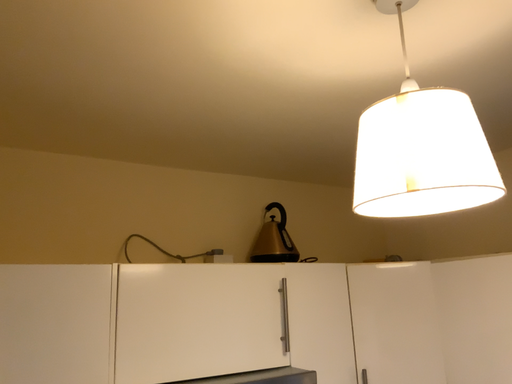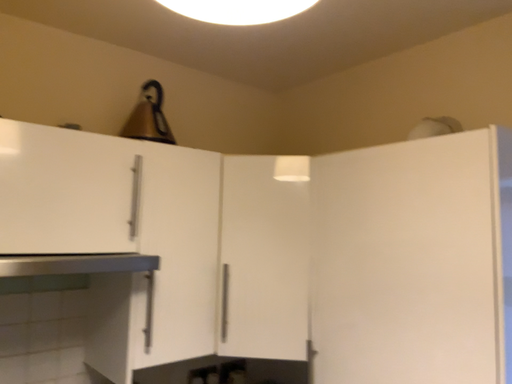
Question: How did the camera likely rotate when shooting the video?

Choices:
 (A) rotated right
 (B) rotated left

Answer: (A)